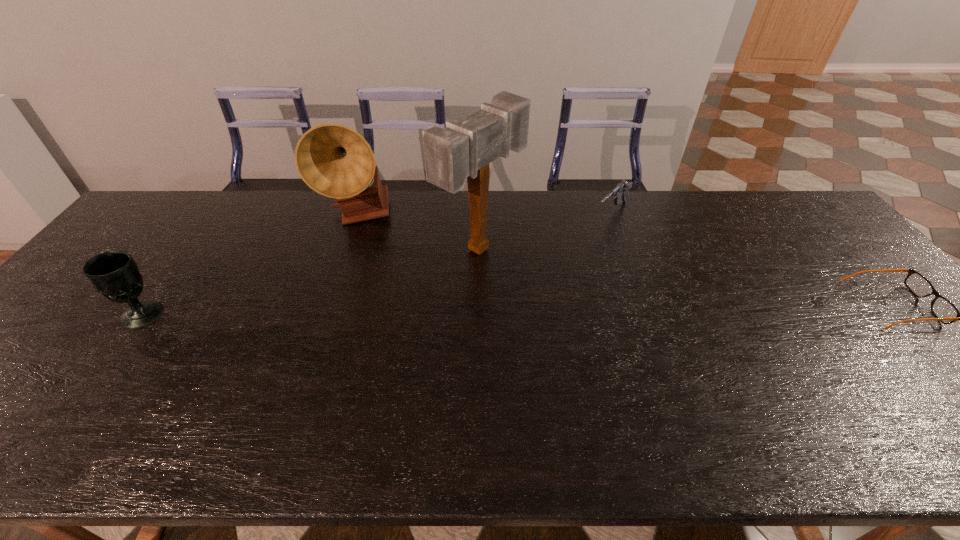
Identify the location of vacant point located 0.160m at the head of the mallet. This screenshot has height=540, width=960. (563, 295).

Locate an element on the screen. This screenshot has height=540, width=960. vacant region located at the head of the mallet is located at coordinates (538, 282).

This screenshot has height=540, width=960. I want to click on vacant space located at the head of the mallet, so click(546, 287).

You are a GUI agent. You are given a task and a screenshot of the screen. Output one action in this format:
    pyautogui.click(x=<x>, y=<y>)
    Task: Click on the vacant region located 0.120m at the barrel of the second object from right to left
    The width and height of the screenshot is (960, 540).
    Given the screenshot: What is the action you would take?
    pyautogui.click(x=582, y=244)

The image size is (960, 540). What are the coordinates of `free space located at the barrel of the second object from right to left` in the screenshot? It's located at (566, 259).

This screenshot has height=540, width=960. I want to click on free space located at the barrel of the second object from right to left, so click(573, 252).

Locate an element on the screen. This screenshot has height=540, width=960. vacant space located 0.390m on the horn of the fourth shortest object is located at coordinates (447, 310).

This screenshot has height=540, width=960. Identify the location of vacant region located 0.320m on the horn of the fourth shortest object. coord(432,295).

Locate an element on the screen. This screenshot has width=960, height=540. free space located 0.210m on the horn of the fourth shortest object is located at coordinates (411, 273).

You are a GUI agent. You are given a task and a screenshot of the screen. Output one action in this format:
    pyautogui.click(x=<x>, y=<y>)
    Task: Click on the mallet situated at the far edge
    This screenshot has height=540, width=960.
    Given the screenshot: What is the action you would take?
    pyautogui.click(x=462, y=150)